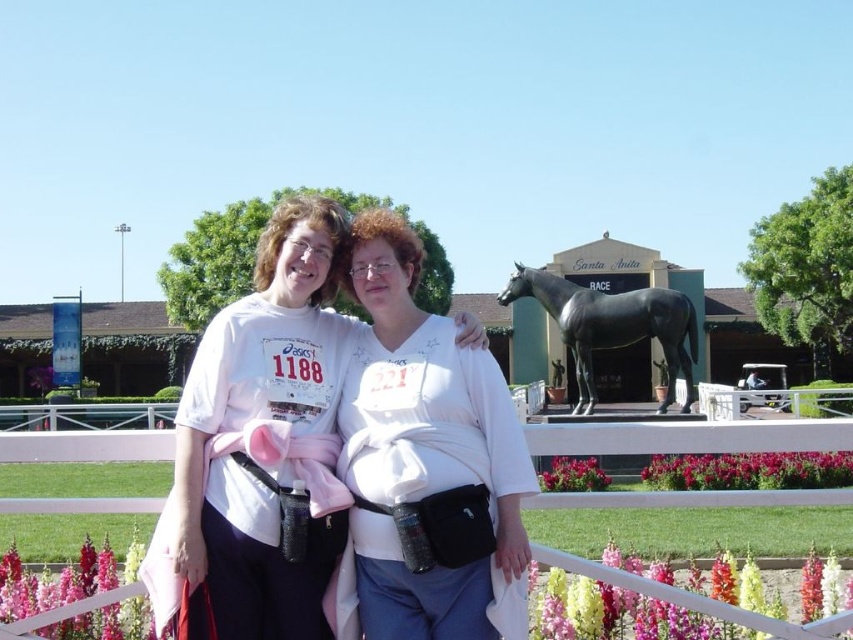
You are a photographer standing in front of the scene. You want to take a photo of the black polished horse at center without the white plastic fence at center blocking the view. Is it possible to do so by moving your position? Explain your reasoning.

The white plastic fence at center is in front of the black polished horse at center, so moving your position might allow you to angle the camera around the fence to capture the horse without obstruction. However, since the fence is directly in front, you would need to move to a side where the fence does not block the line of sight to the horse.

You are a photographer standing in front of the Santa Anita Race building and want to take a photo of the two points mentioned. Which point, point [201,608] or point [103,500], will appear larger in your photo?

Point [201,608] is closer to the viewer than point [103,500], so it will appear larger in the photo.